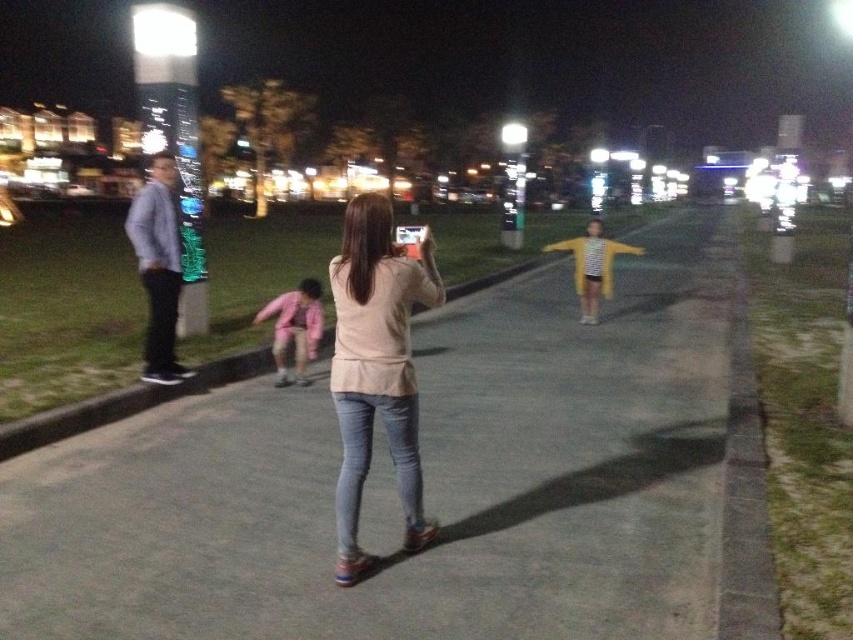
Question: Is light beige sweater at center closer to camera compared to gray concrete curb at center?

Choices:
 (A) no
 (B) yes

Answer: (B)

Question: Estimate the real-world distances between objects in this image. Which object is farther from the light beige sweater at center?

Choices:
 (A) yellow matte cardigan at center
 (B) pink fabric jacket at lower center

Answer: (A)

Question: From the image, what is the correct spatial relationship of gray concrete curb at center in relation to pink fabric jacket at lower center?

Choices:
 (A) left
 (B) right

Answer: (B)

Question: Does light beige sweater at center lie in front of yellow matte cardigan at center?

Choices:
 (A) yes
 (B) no

Answer: (A)

Question: Among these objects, which one is farthest from the camera?

Choices:
 (A) gray concrete curb at center
 (B) light beige sweater at center
 (C) pink fabric jacket at lower center

Answer: (C)

Question: Which object is closer to the camera taking this photo?

Choices:
 (A) yellow matte cardigan at center
 (B) pink fabric jacket at lower center
 (C) gray concrete curb at center

Answer: (C)